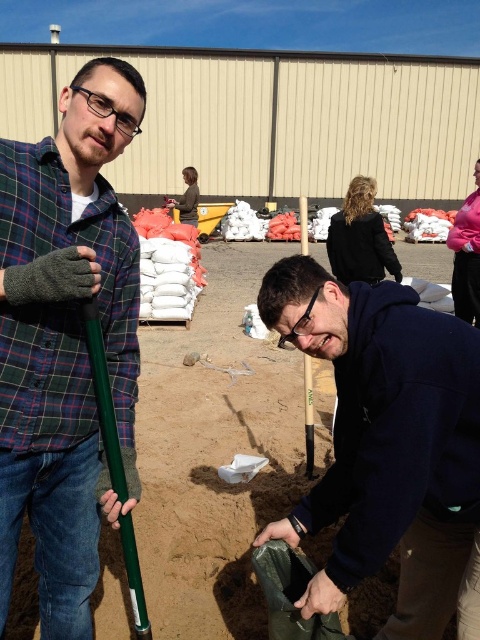
You are a photographer trying to capture a clear shot of the dark blue hoodie at center without the green plastic shovel at left blocking it. Based on their positions, is this possible?

The green plastic shovel at left is in front of the dark blue hoodie at center, so it is blocking the view. To capture a clear shot of the dark blue hoodie at center without the shovel blocking, you would need to move around to a different angle where the shovel is no longer in front.

Based on the scene description and the coordinates provided, what is located at the point with coordinates (x=214, y=454)?

The point at coordinates (x=214, y=454) indicates brown sandy dirt at center.

Consider the image. You are a volunteer at the community service site and need to hand the green plastic shovel at left to the volunteer working with the brown sandy dirt at center. Can you reach them without moving from your current position?

The green plastic shovel at left and brown sandy dirt at center are 6.43 feet apart. Since the distance is over 6 feet, you cannot reach them without moving.